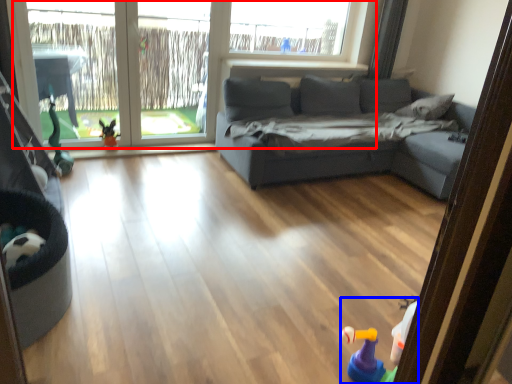
Question: Which object is further to the camera taking this photo, window (highlighted by a red box) or toy (highlighted by a blue box)?

Choices:
 (A) window
 (B) toy

Answer: (A)